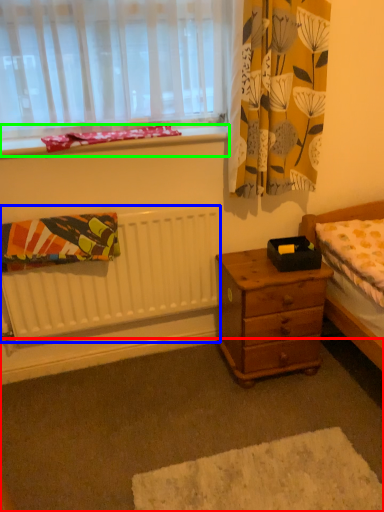
Question: Considering the real-world distances, which object is farthest from plain (highlighted by a red box)? radiator (highlighted by a blue box) or window sill (highlighted by a green box)?

Choices:
 (A) radiator
 (B) window sill

Answer: (B)